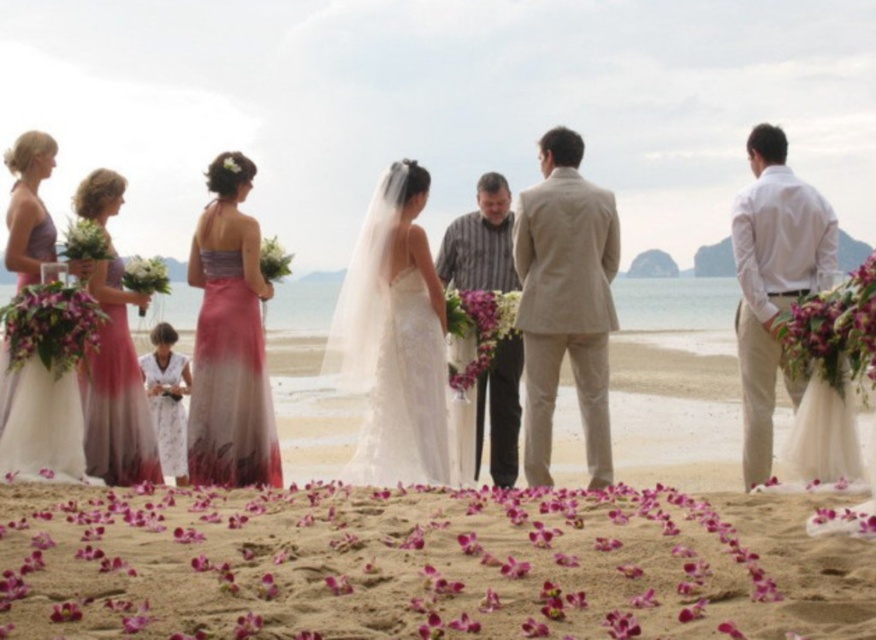
This screenshot has width=876, height=640. What do you see at coordinates (230, 342) in the screenshot?
I see `pink satin dress at center` at bounding box center [230, 342].

Locate an element on the screen. This screenshot has height=640, width=876. pink satin dress at center is located at coordinates (230, 342).

From the picture: Is purple satin dress at left shorter than purple silk bouquet at left?

Incorrect, purple satin dress at left's height does not fall short of purple silk bouquet at left's.

Does purple satin dress at left appear under purple silk bouquet at left?

No.

The image size is (876, 640). What do you see at coordinates (39, 420) in the screenshot?
I see `purple satin dress at left` at bounding box center [39, 420].

Where is `purple satin dress at left`? The height and width of the screenshot is (640, 876). purple satin dress at left is located at coordinates (39, 420).

Does pink satin dress at center appear on the left side of pink satin dress at left?

No, pink satin dress at center is not to the left of pink satin dress at left.

Between pink satin dress at center and pink satin dress at left, which one is positioned higher?

Positioned higher is pink satin dress at center.

Measure the distance between point (235,180) and camera.

Point (235,180) and camera are 11.89 meters apart.

Find the location of a particular element. This screenshot has height=640, width=876. pink satin dress at center is located at coordinates (230, 342).